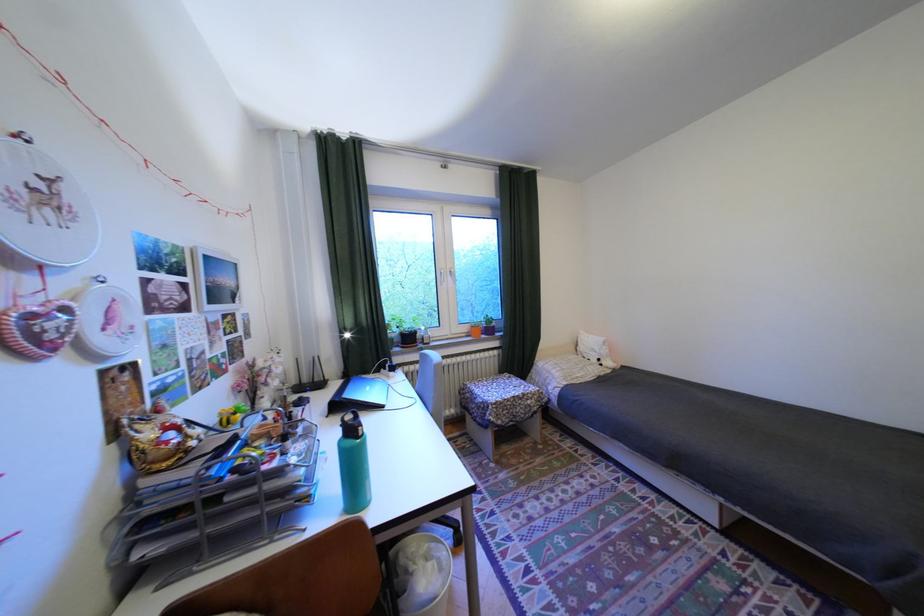
Which object does [231,415] point to?

This point indicates the yellow toy animal.